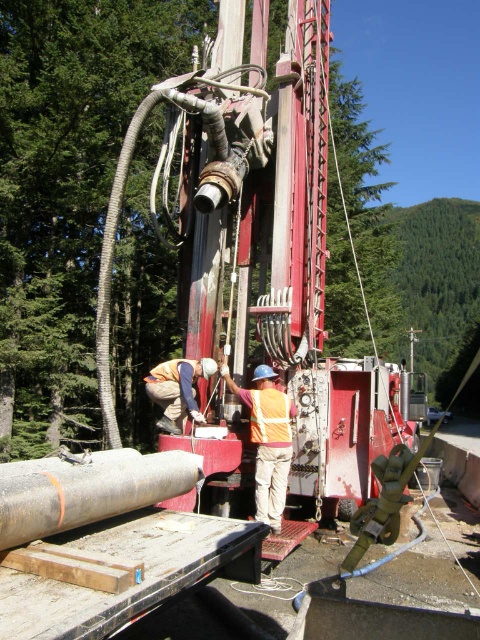
Question: In this image, where is orange reflective vest at center located relative to orange reflective safety vest at center?

Choices:
 (A) above
 (B) below

Answer: (B)

Question: Can you confirm if matte gray pipe at lower left is wider than reflective orange vest at center?

Choices:
 (A) yes
 (B) no

Answer: (A)

Question: Can you confirm if matte gray pipe at lower left is positioned below reflective orange vest at center?

Choices:
 (A) yes
 (B) no

Answer: (B)

Question: Considering the real-world distances, which object is farthest from the orange reflective vest at center?

Choices:
 (A) metallic red trailer truck at center
 (B) matte gray pipe at lower left
 (C) reflective orange vest at center

Answer: (A)

Question: Which point appears farthest from the camera in this image?

Choices:
 (A) (56, 500)
 (B) (278, 269)

Answer: (B)

Question: Estimate the real-world distances between objects in this image. Which object is closer to the matte gray pipe at lower left?

Choices:
 (A) metallic red trailer truck at center
 (B) reflective orange vest at center
 (C) orange reflective vest at center
 (D) orange reflective safety vest at center

Answer: (D)